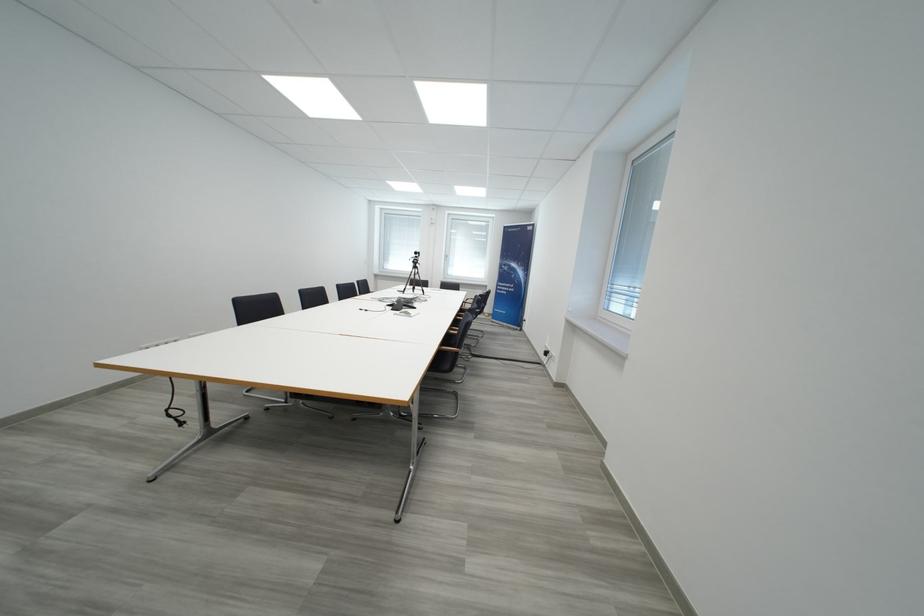
The width and height of the screenshot is (924, 616). I want to click on black chair sitting surface, so click(x=444, y=361).